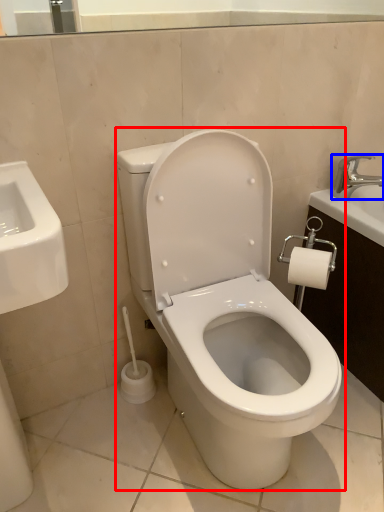
Question: Which point is closer to the camera, toilet (highlighted by a red box) or tap (highlighted by a blue box)?

Choices:
 (A) toilet
 (B) tap

Answer: (A)